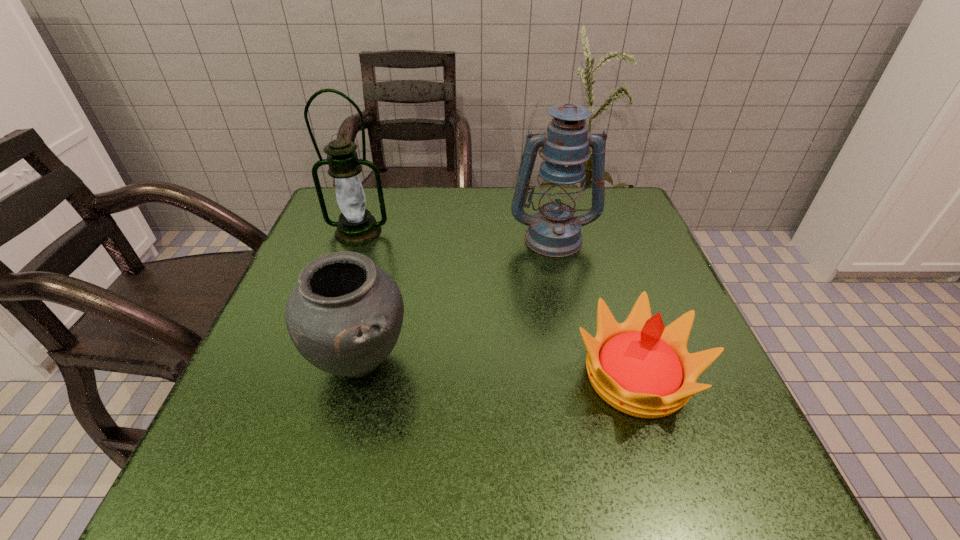
Identify the location of vacant area at the far right corner of the desktop. This screenshot has height=540, width=960. (597, 226).

Where is `vacant space at the near right corner`? This screenshot has width=960, height=540. vacant space at the near right corner is located at coordinates (738, 460).

This screenshot has height=540, width=960. What are the coordinates of `empty location between the urn and the right lantern` in the screenshot? It's located at (456, 299).

The height and width of the screenshot is (540, 960). In order to click on vacant space that is in between the right lantern and the crown in this screenshot , I will do `click(594, 307)`.

This screenshot has width=960, height=540. In order to click on free area in between the crown and the left lantern in this screenshot , I will do `click(497, 304)`.

The image size is (960, 540). I want to click on unoccupied area between the third tallest object and the crown, so click(498, 368).

In order to click on vacant point located between the shortest object and the second shortest object in this screenshot , I will do `click(498, 368)`.

This screenshot has width=960, height=540. In order to click on vacant point located between the shortest object and the right lantern in this screenshot , I will do `click(594, 307)`.

The image size is (960, 540). In order to click on unoccupied area between the shortest object and the left lantern in this screenshot , I will do `click(497, 304)`.

This screenshot has height=540, width=960. I want to click on the closest object relative to the right lantern, so click(640, 367).